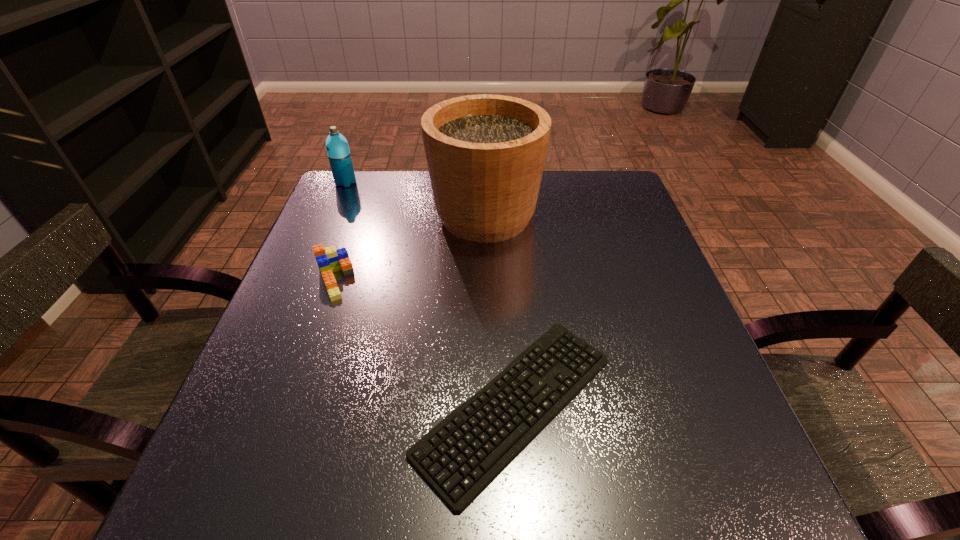
Where is `flowerpot that is at the far edge`? Image resolution: width=960 pixels, height=540 pixels. flowerpot that is at the far edge is located at coordinates (485, 153).

The width and height of the screenshot is (960, 540). In order to click on thermos bottle that is at the far edge in this screenshot , I will do `click(337, 147)`.

Where is `object present at the near edge`? The width and height of the screenshot is (960, 540). object present at the near edge is located at coordinates (459, 457).

The image size is (960, 540). Identify the location of thermos bottle that is at the left edge. (337, 147).

You are a GUI agent. You are given a task and a screenshot of the screen. Output one action in this format:
    pyautogui.click(x=<x>, y=<y>)
    Task: Click on the Lego located at the left edge
    This screenshot has width=960, height=540.
    Given the screenshot: What is the action you would take?
    pyautogui.click(x=329, y=260)

Where is `object that is at the far left corner`? Image resolution: width=960 pixels, height=540 pixels. object that is at the far left corner is located at coordinates 337,147.

In the image, there is a desktop. Identify the location of vacant space at the near edge. (411, 477).

Identify the location of vacant area at the left edge. The image size is (960, 540). (324, 342).

The width and height of the screenshot is (960, 540). In the image, there is a desktop. Find the location of `vacant space at the right edge`. vacant space at the right edge is located at coordinates (581, 229).

This screenshot has height=540, width=960. I want to click on free space at the far left corner of the desktop, so click(x=370, y=204).